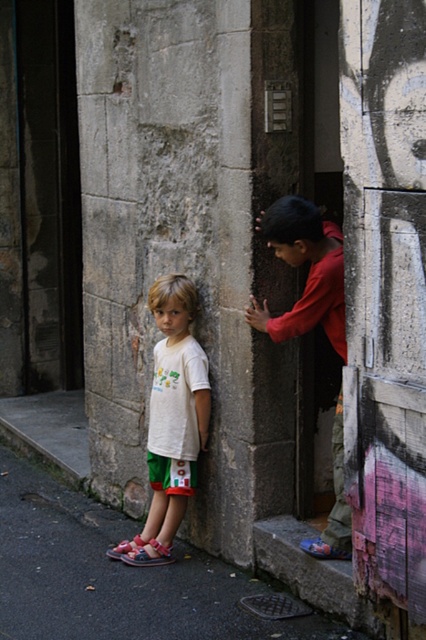
Is white cotton shirt at center wider than red cotton shirt at center?

Yes.

Can you confirm if white cotton shirt at center is positioned below red cotton shirt at center?

Correct, white cotton shirt at center is located below red cotton shirt at center.

Is point (163, 529) positioned behind point (313, 314)?

Yes.

Identify the location of white cotton shirt at center. The height and width of the screenshot is (640, 426). (172, 420).

Can you confirm if concrete textured pillar at center is shorter than red cotton shirt at center?

No.

Is concrete textured pillar at center taller than red cotton shirt at center?

Yes.

The width and height of the screenshot is (426, 640). I want to click on concrete textured pillar at center, so click(x=385, y=294).

Which is in front, point (388, 248) or point (181, 284)?

Point (388, 248) is in front.

Who is higher up, concrete textured pillar at center or white cotton shirt at center?

Positioned higher is concrete textured pillar at center.

The image size is (426, 640). Find the location of `concrete textured pillar at center`. concrete textured pillar at center is located at coordinates (385, 294).

Where is `concrete textured pillar at center`? concrete textured pillar at center is located at coordinates (385, 294).